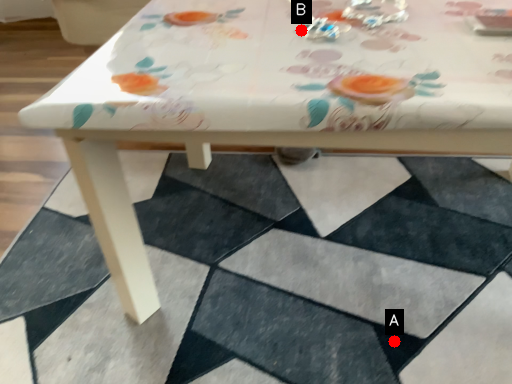
Question: Two points are circled on the image, labeled by A and B beside each circle. Which point appears closest to the camera in this image?

Choices:
 (A) A is closer
 (B) B is closer

Answer: (B)